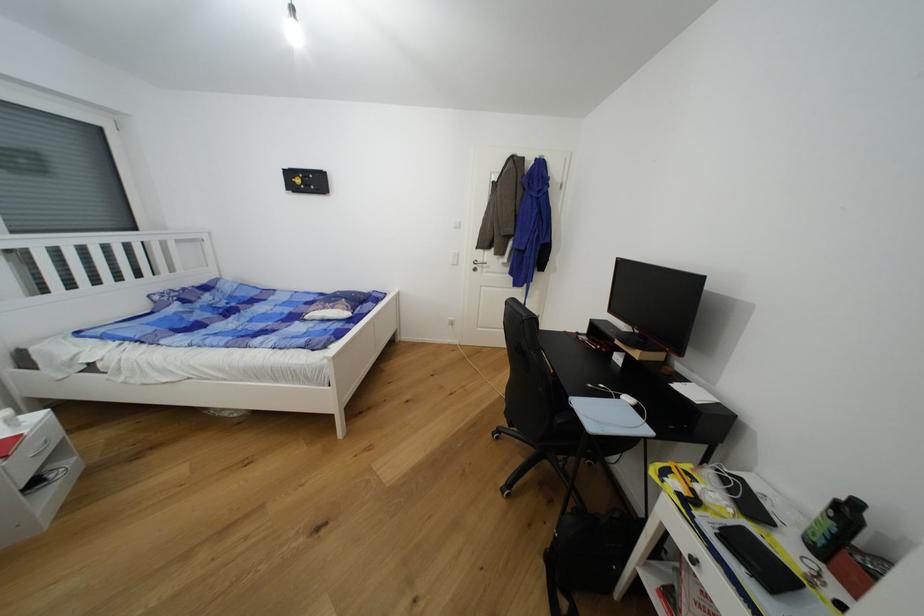
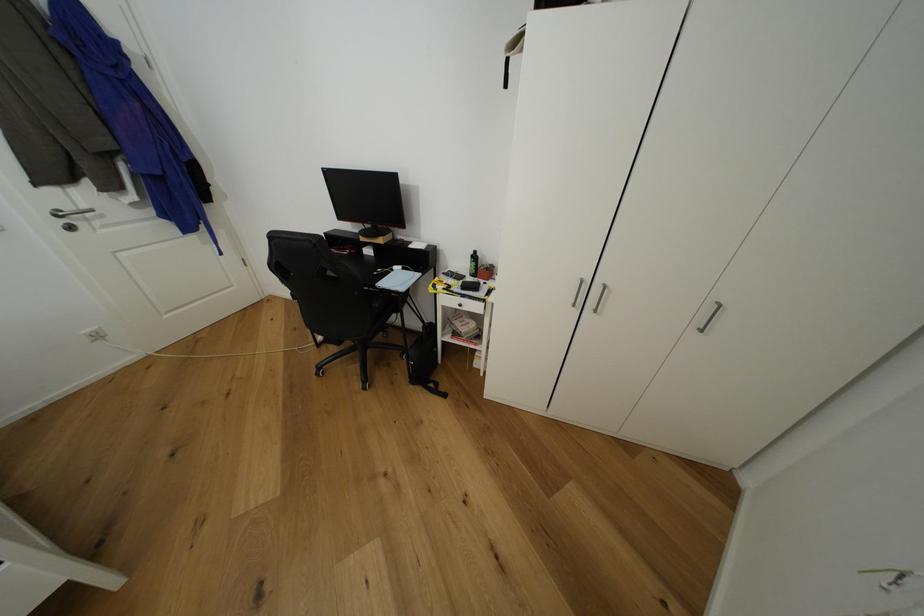
Find the pixel in the second image that matches (x=844, y=507) in the first image.

(478, 257)